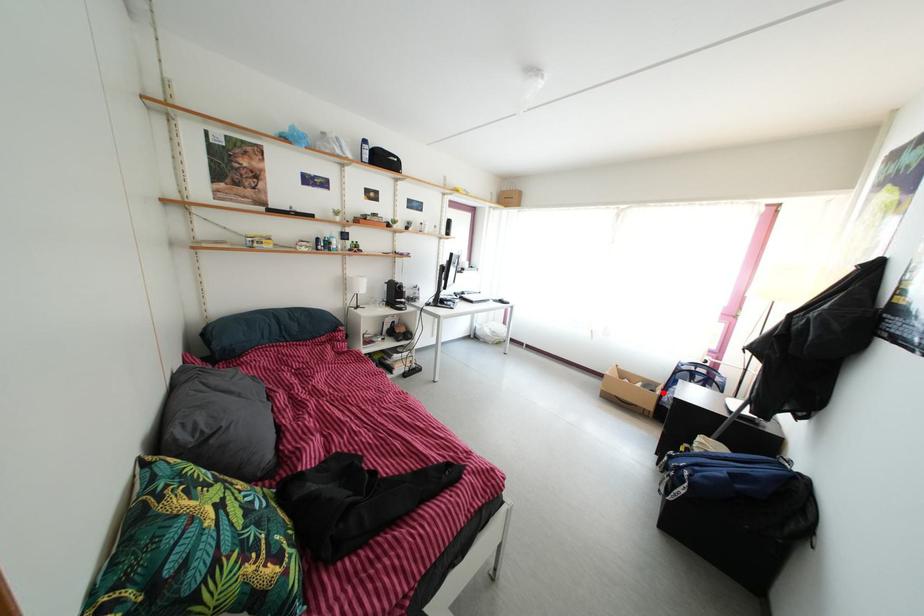
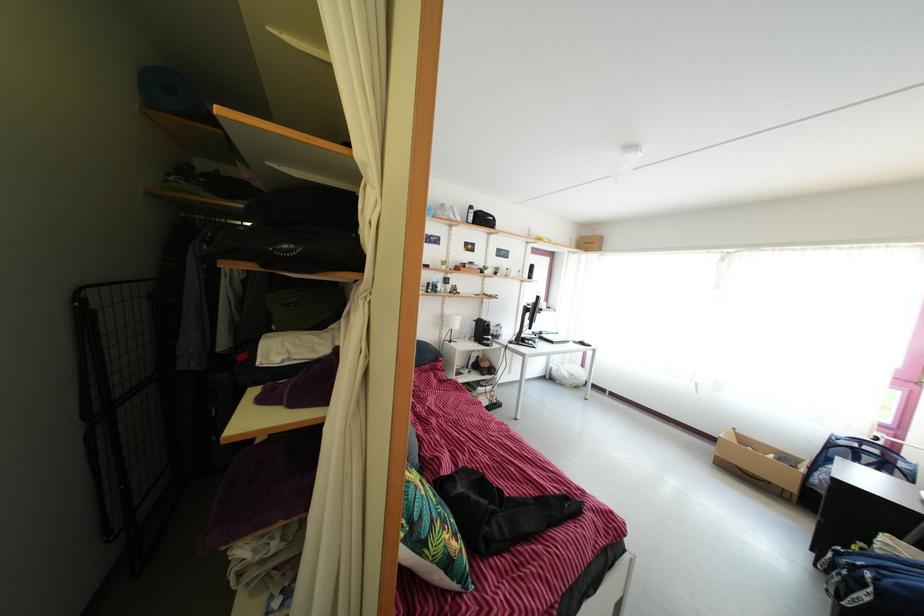
Question: A red point is marked in image1. In image2, is the corresponding 3D point closer to the camera or farther? Reply with the corresponding letter.

Choices:
 (A) The corresponding 3D point is closer.
 (B) The corresponding 3D point is farther.

Answer: (B)